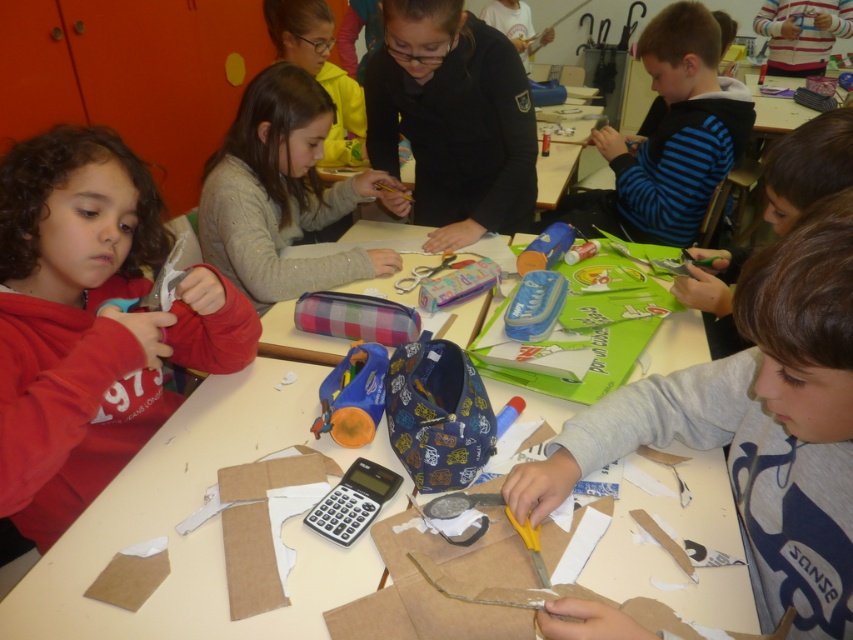
Question: From the image, what is the correct spatial relationship of matte red sweatshirt at left in relation to black matte pencil case at center?

Choices:
 (A) right
 (B) left

Answer: (B)

Question: Which of the following is the farthest from the observer?

Choices:
 (A) (106, 385)
 (B) (703, 474)
 (C) (479, 163)

Answer: (C)

Question: Does gray fabric scissors at right lie in front of matte gray sweater at center?

Choices:
 (A) yes
 (B) no

Answer: (A)

Question: Which point is farther from the camera taking this photo?

Choices:
 (A) (851, 467)
 (B) (734, 326)
 (C) (624, 145)
 (D) (90, 280)

Answer: (C)

Question: Which object appears farthest from the camera in this image?

Choices:
 (A) dark blue fabric at upper right
 (B) blue striped sweater at upper right

Answer: (B)

Question: Observing the image, what is the correct spatial positioning of brown paper at center in reference to blue striped sweater at upper right?

Choices:
 (A) left
 (B) right

Answer: (A)